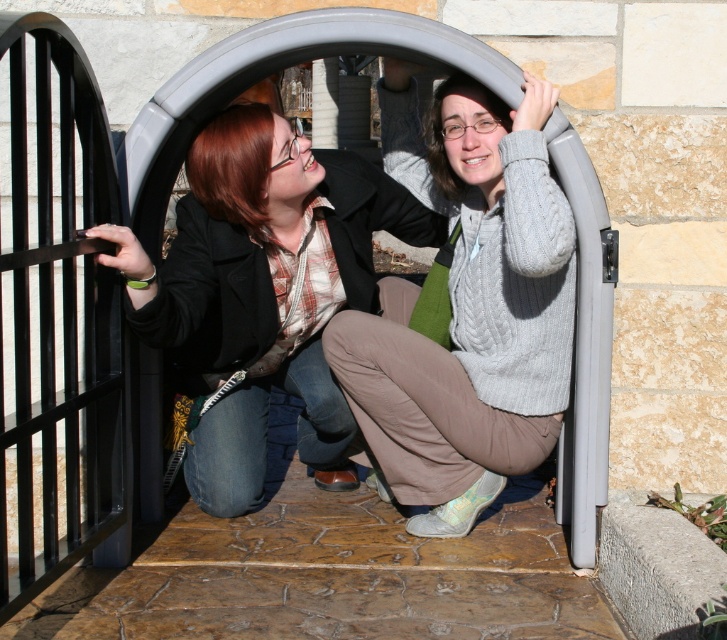
What do you see at coordinates (465, 307) in the screenshot?
I see `cable-knit sweater at center` at bounding box center [465, 307].

Between point (403, 173) and point (190, 465), which one is positioned behind?

Positioned behind is point (403, 173).

Find the location of a particular element. This screenshot has height=640, width=727. cable-knit sweater at center is located at coordinates (465, 307).